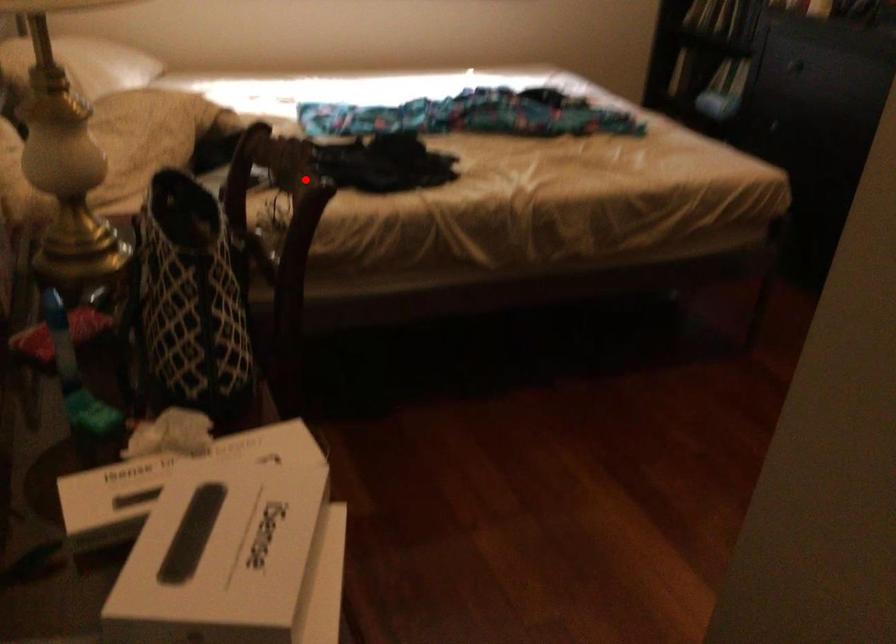
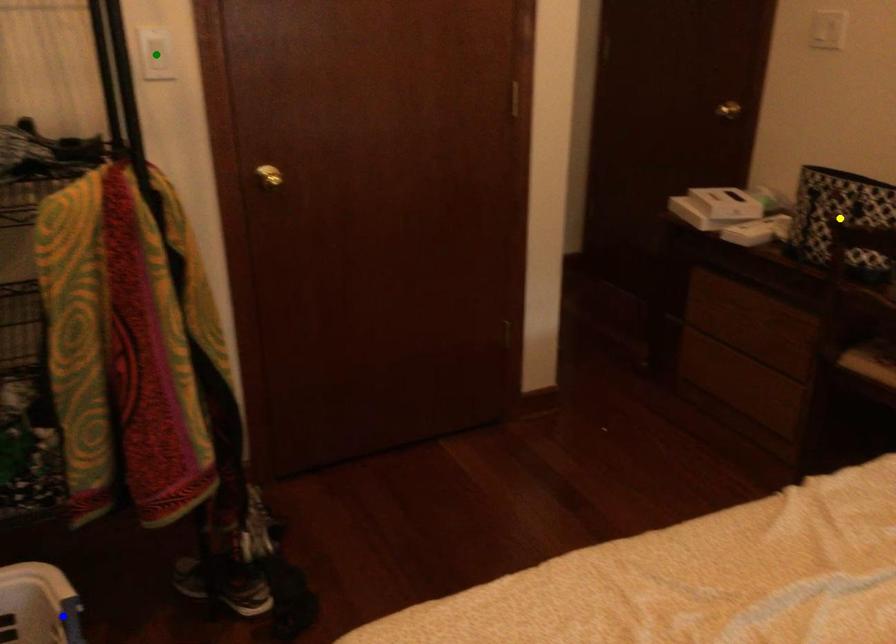
Question: I am providing you with two images of the same scene from different viewpoints. A red point is marked on the first image. You are given multiple points on the second image. Which point in image 2 represents the same 3d spot as the red point in image 1?

Choices:
 (A) yellow point
 (B) green point
 (C) blue point

Answer: (A)